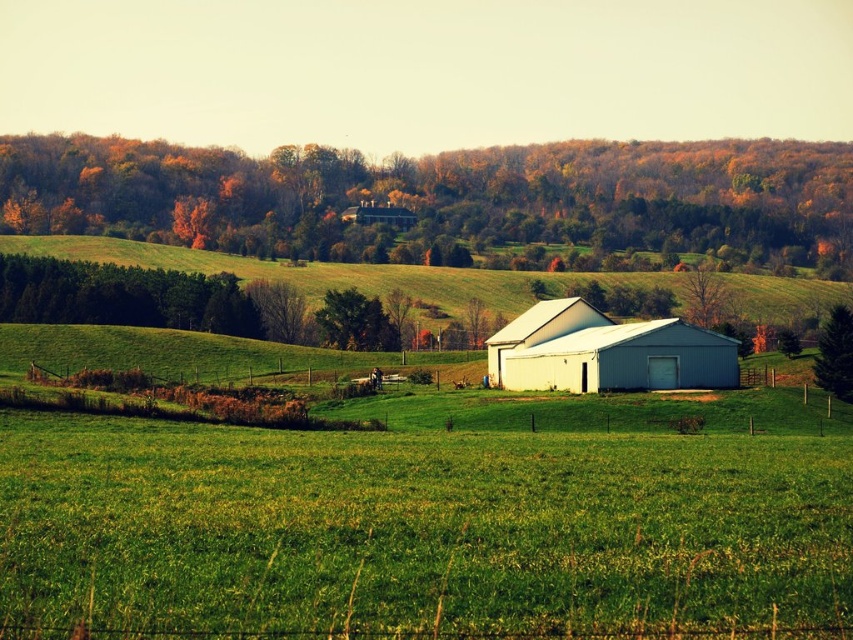
Does autumn leaves at upper center have a greater width compared to green leafy tree at center?

Indeed, autumn leaves at upper center has a greater width compared to green leafy tree at center.

Is point (289, 147) farther from viewer compared to point (360, 298)?

Yes, point (289, 147) is farther from viewer.

Locate an element on the screen. autumn leaves at upper center is located at coordinates (440, 195).

Can you confirm if white matte barn at center is positioned to the left of green matte tree at right?

Correct, you'll find white matte barn at center to the left of green matte tree at right.

Who is higher up, white matte barn at center or green matte tree at right?

Positioned higher is green matte tree at right.

What do you see at coordinates (606, 353) in the screenshot?
I see `white matte barn at center` at bounding box center [606, 353].

Locate an element on the screen. The height and width of the screenshot is (640, 853). white matte barn at center is located at coordinates (606, 353).

Which is in front, point (109, 250) or point (602, 324)?

Point (602, 324) is in front.

Looking at this image, does green grassy hillside at center have a lesser width compared to white matte barn at center?

No, green grassy hillside at center is not thinner than white matte barn at center.

Is point (463, 285) closer to viewer compared to point (548, 333)?

No, (463, 285) is further to viewer.

Identify the location of green grassy hillside at center. The width and height of the screenshot is (853, 640). (366, 275).